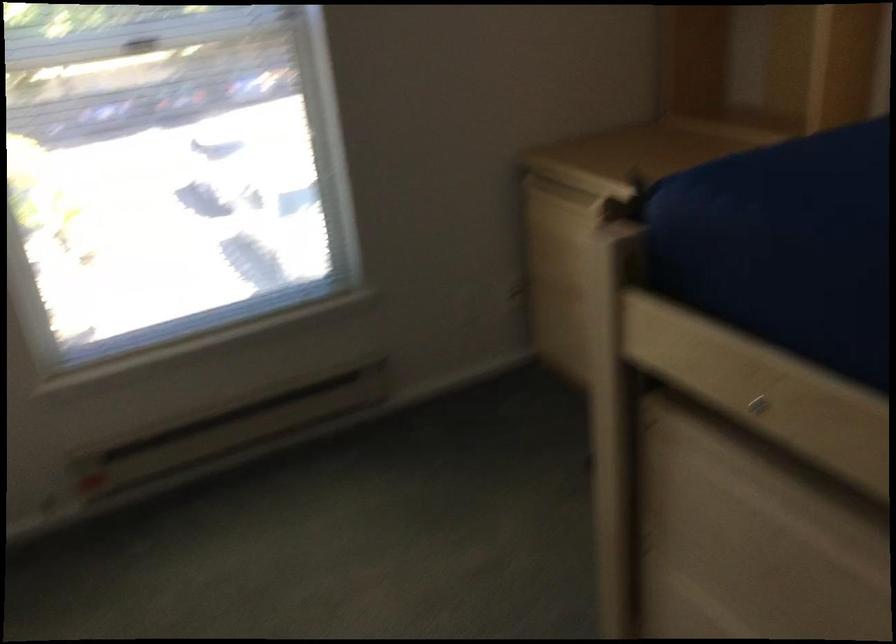
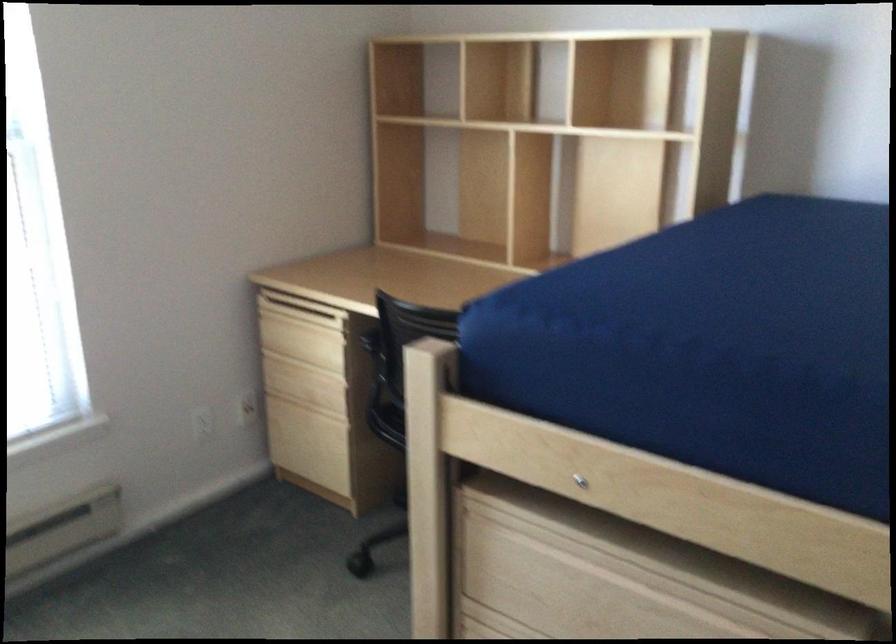
In the second image, find the point that corresponds to the point at 444,303 in the first image.

(185, 424)